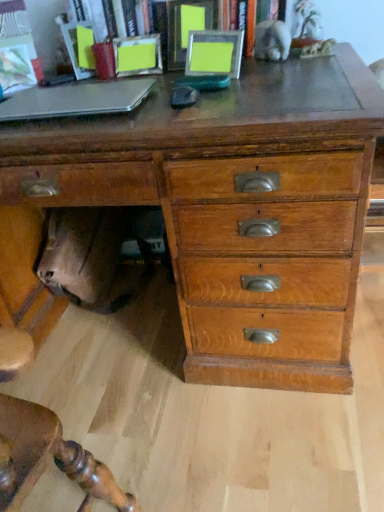
Locate an element on the screen. unoccupied area in front of silver metallic laptop at left is located at coordinates (81, 126).